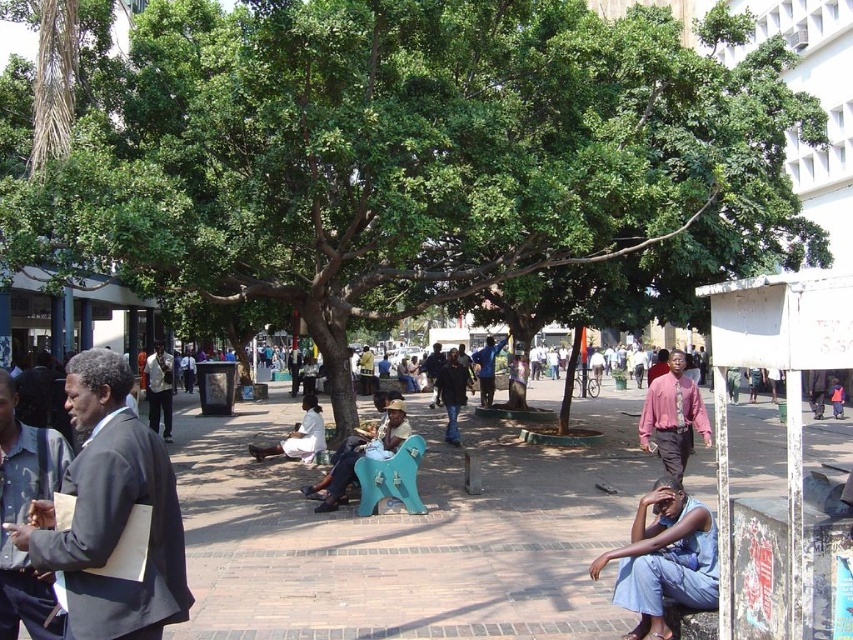
Question: Which is farther from the green leafy tree at center?

Choices:
 (A) blue denim shirt at center
 (B) matte black suit at left

Answer: (A)

Question: Which point is closer to the camera?

Choices:
 (A) (160, 356)
 (B) (496, 353)
 (C) (650, 496)
 (D) (181, 620)

Answer: (D)

Question: Considering the relative positions of green leafy tree at center and pink shirt at center in the image provided, where is green leafy tree at center located with respect to pink shirt at center?

Choices:
 (A) left
 (B) right

Answer: (A)

Question: In this image, where is dark gray suit at left located relative to dark brown leather jacket at left?

Choices:
 (A) right
 (B) left

Answer: (A)

Question: In this image, where is dark brown leather jacket at left located relative to dark blue jeans at center?

Choices:
 (A) left
 (B) right

Answer: (A)

Question: Which object is the closest to the dark brown leather jacket at left?

Choices:
 (A) wooden bench at center
 (B) matte black suit at left
 (C) dark gray suit at left

Answer: (C)